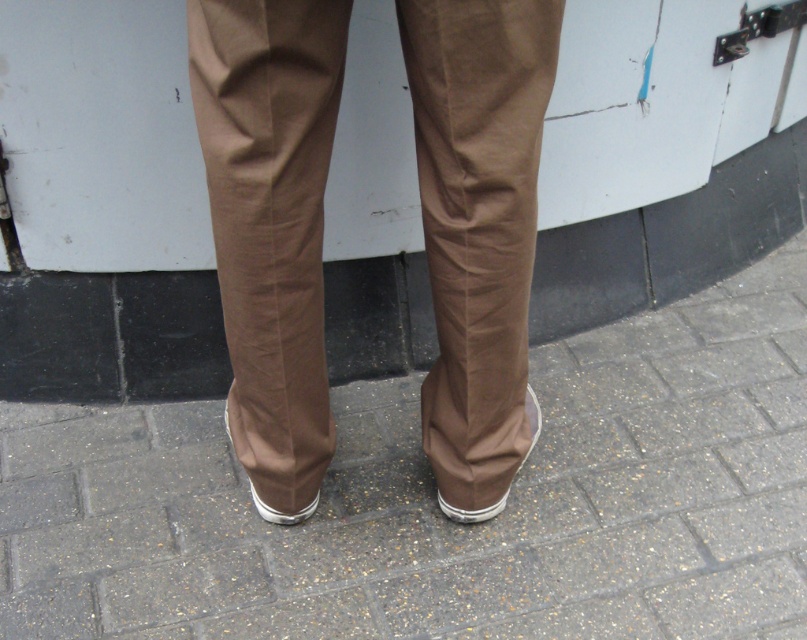
Where is `brown cotton pants at center`? The height and width of the screenshot is (640, 807). brown cotton pants at center is located at coordinates (270, 225).

Between point (291, 228) and point (231, 440), which one is positioned behind?

Point (231, 440)

Who is more forward, (x=552, y=60) or (x=254, y=499)?

Positioned in front is point (x=552, y=60).

I want to click on brown cotton pants at center, so click(x=270, y=225).

The image size is (807, 640). Find the location of `brown fabric pants at center`. brown fabric pants at center is located at coordinates (437, 508).

Which of these two, brown fabric pants at center or white rubber shoe at lower center, stands shorter?

With less height is white rubber shoe at lower center.

Which is in front, point (714, 548) or point (249, 484)?

Positioned in front is point (714, 548).

Where is `brown fabric pants at center`? The width and height of the screenshot is (807, 640). brown fabric pants at center is located at coordinates click(x=437, y=508).

Is matte brown shoe at lower center in front of white rubber shoe at lower center?

Yes, it is in front of white rubber shoe at lower center.

Does point (504, 497) lie behind point (274, 509)?

Yes, it is.

This screenshot has height=640, width=807. In order to click on matte brown shoe at lower center in this screenshot , I will do [471, 509].